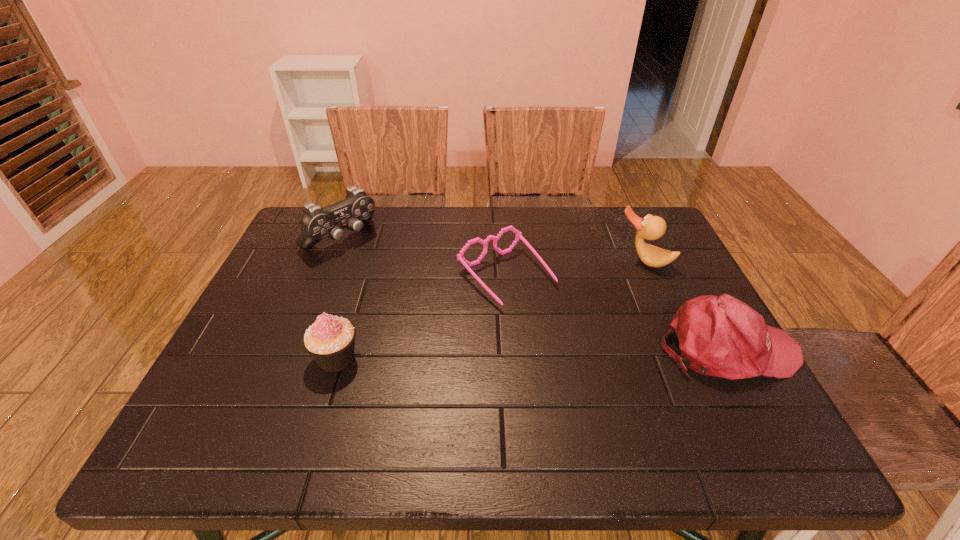
Where is `free space located 0.220m on the surface of the control with buttons`? Image resolution: width=960 pixels, height=540 pixels. free space located 0.220m on the surface of the control with buttons is located at coordinates (406, 292).

You are a GUI agent. You are given a task and a screenshot of the screen. Output one action in this format:
    pyautogui.click(x=<x>, y=<y>)
    Task: Click on the vacant space situated on the surface of the control with buttons
    
    Given the screenshot: What is the action you would take?
    pyautogui.click(x=371, y=261)

Where is `vacant space located on the surface of the control with buttons`? The height and width of the screenshot is (540, 960). vacant space located on the surface of the control with buttons is located at coordinates (451, 329).

This screenshot has width=960, height=540. I want to click on free space located on the arms of the shortest object, so click(635, 409).

Find the location of `vacant space located 0.300m on the arms of the shortest object`. vacant space located 0.300m on the arms of the shortest object is located at coordinates click(x=620, y=394).

I want to click on vacant space situated 0.150m on the arms of the shortest object, so click(573, 346).

In order to click on duck located at the far edge in this screenshot , I will do `click(651, 227)`.

Find the location of a particular element. The height and width of the screenshot is (540, 960). control present at the far edge is located at coordinates (357, 208).

Locate an element on the screen. The image size is (960, 540). spectacles at the far edge is located at coordinates (460, 257).

You are a GUI agent. You are given a task and a screenshot of the screen. Output one action in this format:
    pyautogui.click(x=<x>, y=<y>)
    Task: Click on the cupcake at the near edge
    The image size is (960, 540).
    Given the screenshot: What is the action you would take?
    pyautogui.click(x=330, y=340)